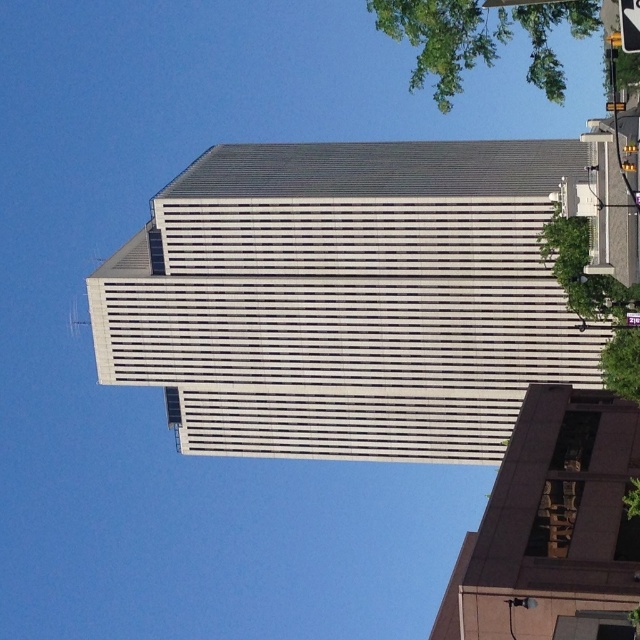
Question: Which point appears closest to the camera in this image?

Choices:
 (A) (580, 291)
 (B) (372, 1)

Answer: (B)

Question: Is brown textured building at lower right to the left of green leafy tree at upper right from the viewer's perspective?

Choices:
 (A) yes
 (B) no

Answer: (A)

Question: Is brown textured building at lower right thinner than green leafy tree at upper right?

Choices:
 (A) yes
 (B) no

Answer: (A)

Question: Does green leafy tree at upper right have a larger size compared to green leafy tree at right?

Choices:
 (A) yes
 (B) no

Answer: (A)

Question: Which point is farther from the camera taking this photo?

Choices:
 (A) (579, 291)
 (B) (346, 214)

Answer: (B)

Question: Which object is the closest to the brown textured building at lower right?

Choices:
 (A) gray concrete building at center
 (B) green leafy tree at right

Answer: (B)